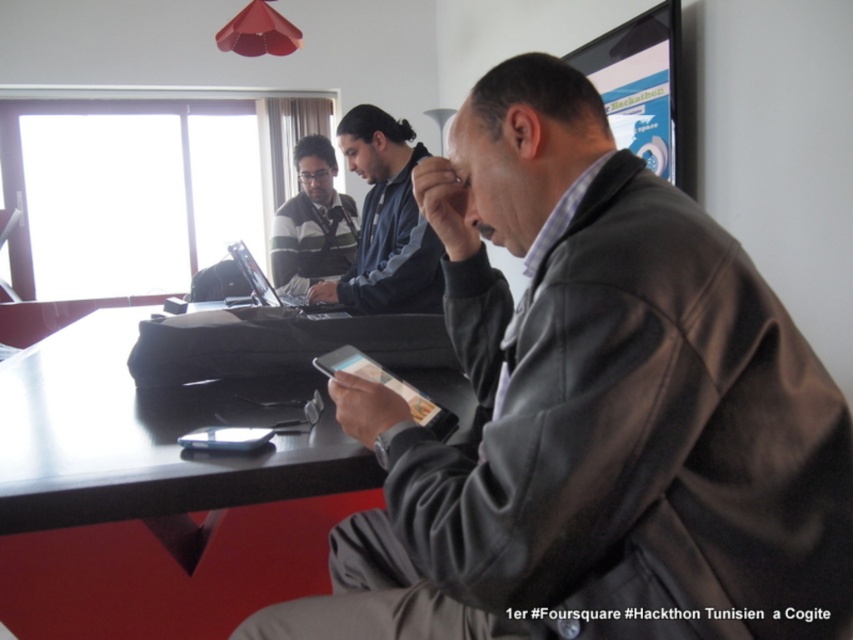
Who is more forward, (244,381) or (352,291)?

Point (244,381)

You are a GUI agent. You are given a task and a screenshot of the screen. Output one action in this format:
    pyautogui.click(x=<x>, y=<y>)
    Task: Click on the black glossy table at center
    The height and width of the screenshot is (640, 853).
    Given the screenshot: What is the action you would take?
    pyautogui.click(x=155, y=493)

The width and height of the screenshot is (853, 640). I want to click on black glossy table at center, so (155, 493).

Is dark blue fleece at center above striped sweater at center?

No.

Does dark blue fleece at center lie in front of striped sweater at center?

Yes, it is.

Is point (426, 285) positioned after point (314, 276)?

No, it is in front of (314, 276).

Identify the location of dark blue fleece at center. Image resolution: width=853 pixels, height=640 pixels. (386, 221).

Identify the location of dark brown leather jacket at center. (592, 412).

Which is more to the right, dark brown leather jacket at center or dark blue fleece at center?

dark brown leather jacket at center is more to the right.

What do you see at coordinates (592, 412) in the screenshot? I see `dark brown leather jacket at center` at bounding box center [592, 412].

The width and height of the screenshot is (853, 640). Find the location of `dark brown leather jacket at center`. dark brown leather jacket at center is located at coordinates point(592,412).